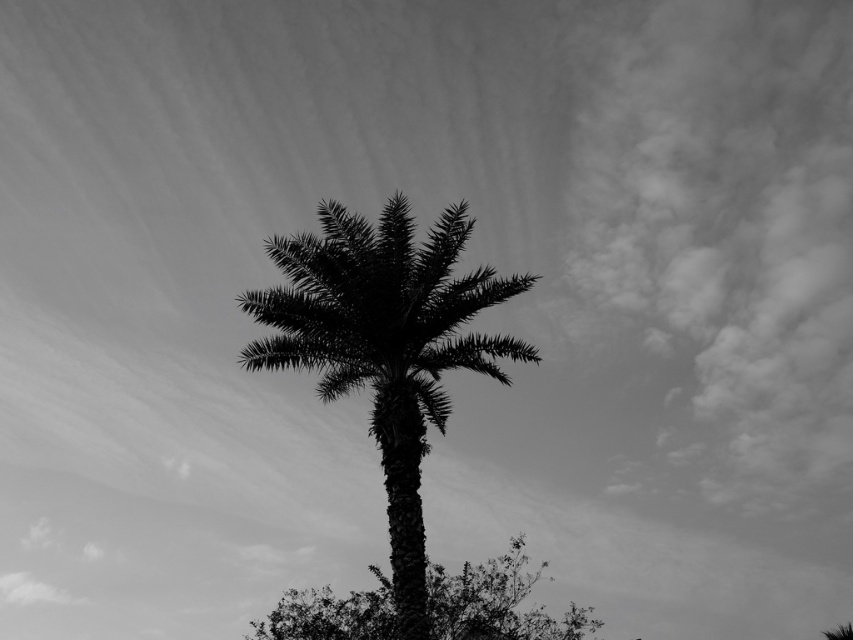
Is silhouette leafy palm at center shorter than silhouette leafy tree at center?

In fact, silhouette leafy palm at center may be taller than silhouette leafy tree at center.

How distant is silhouette leafy palm at center from silhouette leafy tree at center?

silhouette leafy palm at center is 5.77 meters away from silhouette leafy tree at center.

Describe the element at coordinates (386, 346) in the screenshot. The width and height of the screenshot is (853, 640). I see `silhouette leafy palm at center` at that location.

Where is `silhouette leafy palm at center`? silhouette leafy palm at center is located at coordinates (386, 346).